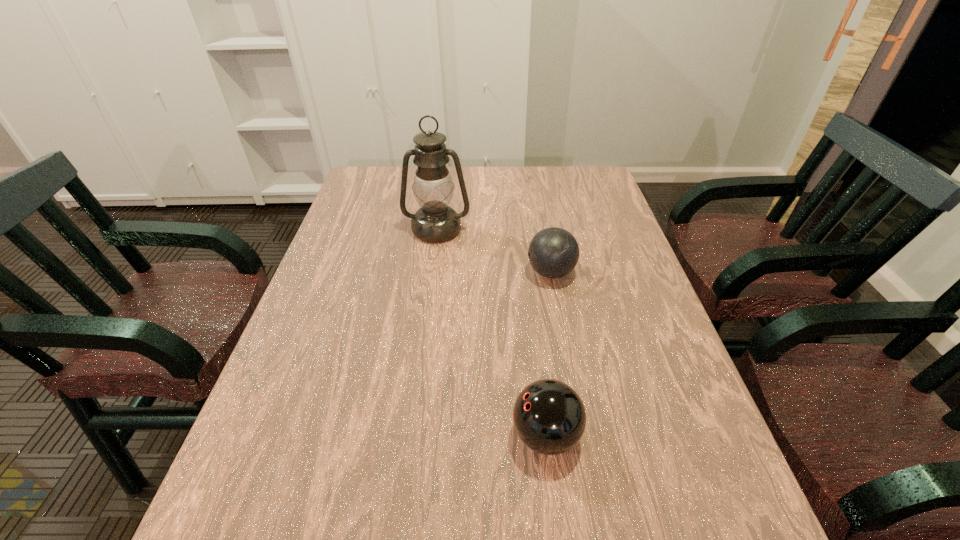
You are a GUI agent. You are given a task and a screenshot of the screen. Output one action in this format:
    pyautogui.click(x=<x>, y=<y>)
    Task: Click on the vacant area that lies between the oil lamp and the nearest object
    
    Given the screenshot: What is the action you would take?
    pyautogui.click(x=492, y=333)

Locate an element on the screen. This screenshot has height=540, width=960. vacant space that is in between the tallest object and the farther bowling ball is located at coordinates (493, 251).

This screenshot has height=540, width=960. I want to click on empty location between the farthest object and the nearest object, so click(x=492, y=333).

The height and width of the screenshot is (540, 960). What are the coordinates of `free space between the farther bowling ball and the nearest object` in the screenshot? It's located at (548, 354).

Locate an element on the screen. This screenshot has height=540, width=960. blank region between the tallest object and the farther bowling ball is located at coordinates 493,251.

Identify the location of the second closest object to the farther bowling ball. The height and width of the screenshot is (540, 960). (549, 416).

Select which object is the second closest to the nearest object. Please provide its 2D coordinates. Your answer should be formatted as a tuple, i.e. [(x, y)], where the tuple contains the x and y coordinates of a point satisfying the conditions above.

[(435, 221)]